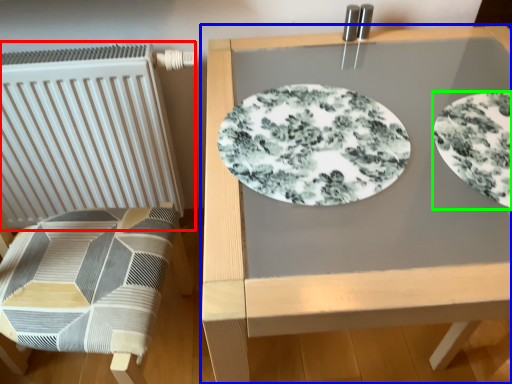
Question: Estimate the real-world distances between objects in this image. Which object is closer to radiator (highlighted by a red box), table (highlighted by a blue box) or plate (highlighted by a green box)?

Choices:
 (A) table
 (B) plate

Answer: (A)